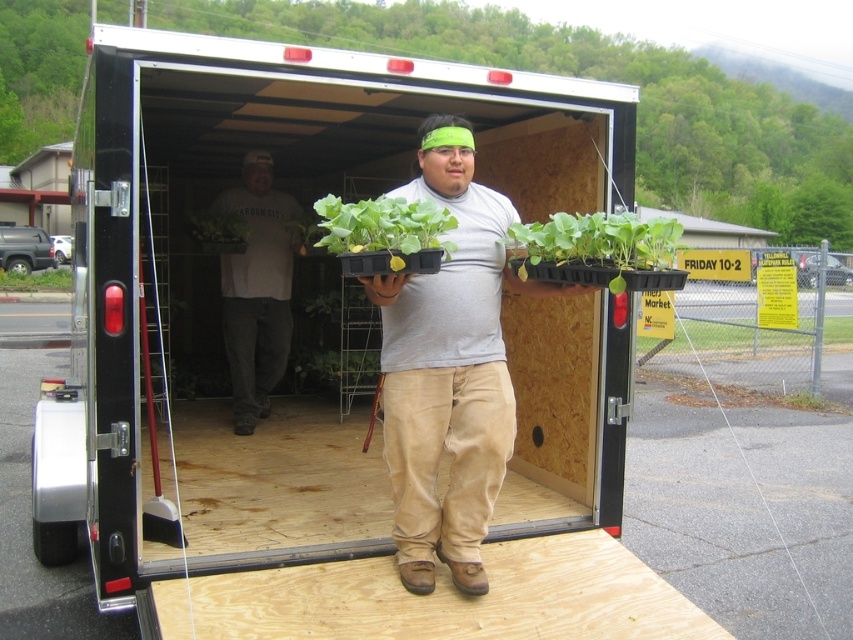
Question: Can you confirm if black plastic trailer at center is bigger than white cotton shirt at center?

Choices:
 (A) no
 (B) yes

Answer: (B)

Question: Which of the following is the closest to the observer?

Choices:
 (A) black plastic trailer at center
 (B) green plastic tray at center

Answer: (B)

Question: Which of the following is the closest to the observer?

Choices:
 (A) green leafy plant at center
 (B) matte gray shirt at center

Answer: (B)

Question: From the image, what is the correct spatial relationship of green leafy plant at lower right in relation to green matte plant at center?

Choices:
 (A) left
 (B) right

Answer: (B)

Question: Estimate the real-world distances between objects in this image. Which object is closer to the green matte plant at center?

Choices:
 (A) matte gray shirt at center
 (B) green matte tray at center
 (C) black plastic trailer at center
 (D) green leafy plant at center

Answer: (C)

Question: Is matte gray shirt at center smaller than green leafy plant at lower right?

Choices:
 (A) no
 (B) yes

Answer: (A)